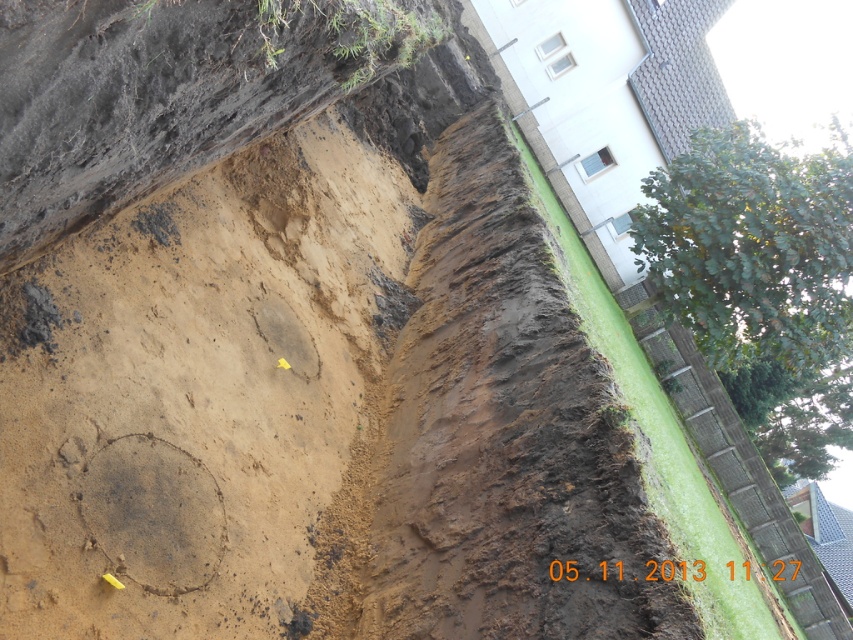
Question: Does brown sandy mud at center have a larger size compared to brown muddy soil at center?

Choices:
 (A) no
 (B) yes

Answer: (B)

Question: Which object appears farthest from the camera in this image?

Choices:
 (A) brown sandy mud at center
 (B) brown muddy soil at center

Answer: (B)

Question: Can you confirm if brown sandy mud at center is smaller than brown muddy soil at center?

Choices:
 (A) yes
 (B) no

Answer: (B)

Question: Does brown sandy mud at center appear on the left side of brown muddy soil at center?

Choices:
 (A) yes
 (B) no

Answer: (A)

Question: Which object appears farthest from the camera in this image?

Choices:
 (A) brown muddy soil at center
 (B) brown sandy mud at center

Answer: (A)